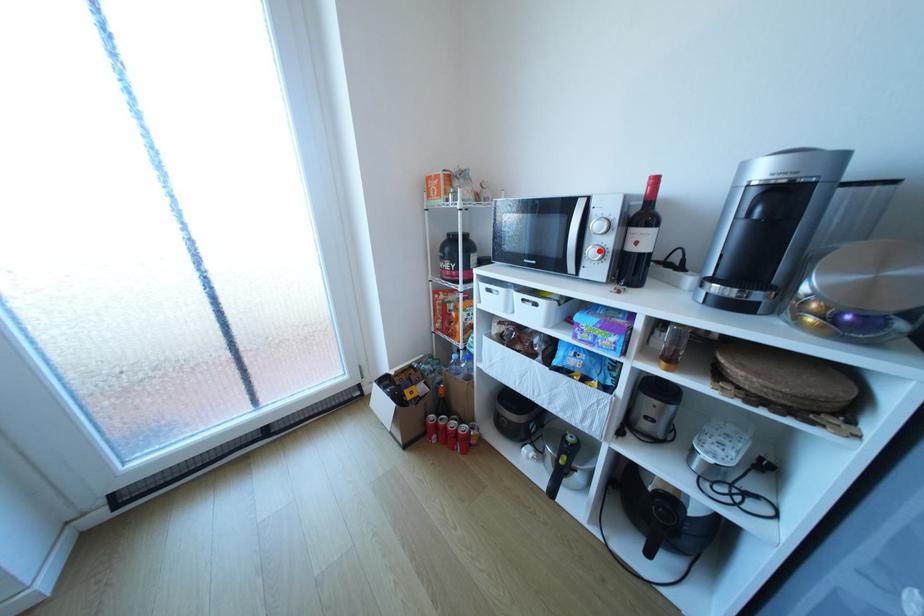
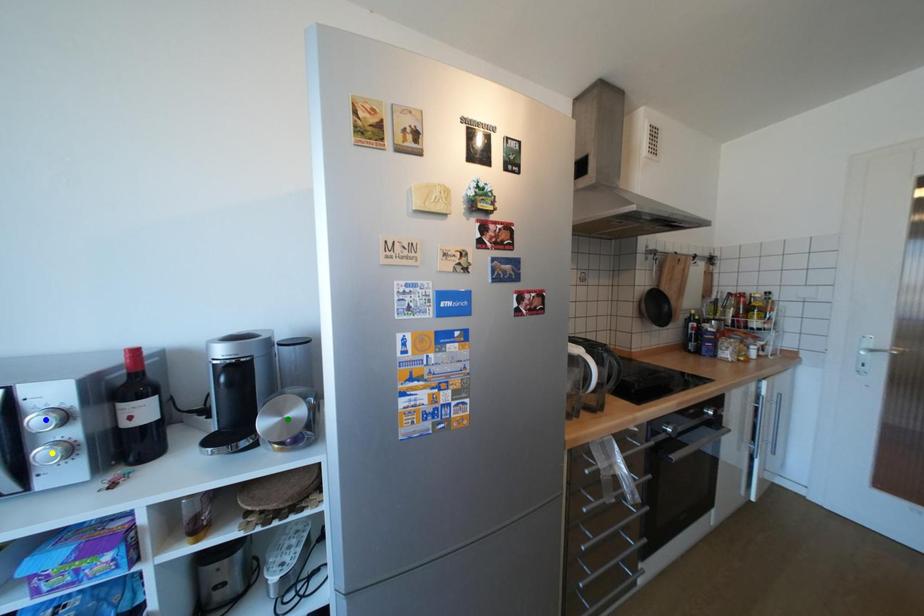
Question: I am providing you with two images of the same scene from different viewpoints. A red point is marked on the first image. You are given multiple points on the second image. In image 2, which mark is for the same physical point as the one in image 1?

Choices:
 (A) yellow point
 (B) green point
 (C) blue point

Answer: (A)